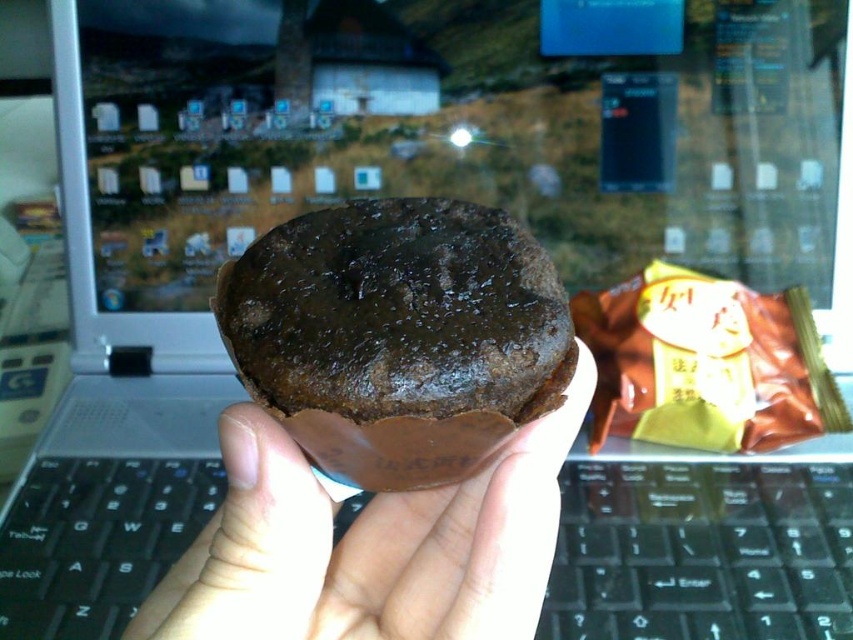
Question: Which point is closer to the camera?

Choices:
 (A) (386, 513)
 (B) (624, 524)

Answer: (A)

Question: Among these points, which one is farthest from the camera?

Choices:
 (A) (682, 545)
 (B) (288, 429)

Answer: (A)

Question: Is chocolate matte cake at center smaller than brown matte cupcake at center?

Choices:
 (A) no
 (B) yes

Answer: (B)

Question: Can you confirm if black plastic keyboard at center is thinner than brown matte cupcake at center?

Choices:
 (A) no
 (B) yes

Answer: (A)

Question: Considering the real-world distances, which object is closest to the black plastic keyboard at center?

Choices:
 (A) brown matte cupcake at center
 (B) chocolate matte cake at center

Answer: (A)

Question: Can you confirm if black plastic keyboard at center is thinner than chocolate matte cake at center?

Choices:
 (A) yes
 (B) no

Answer: (B)